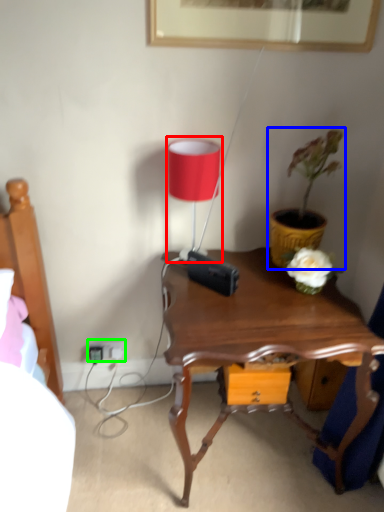
Question: Which is farther away from table lamp (highlighted by a red box)? houseplant (highlighted by a blue box) or electric outlet (highlighted by a green box)?

Choices:
 (A) houseplant
 (B) electric outlet

Answer: (B)